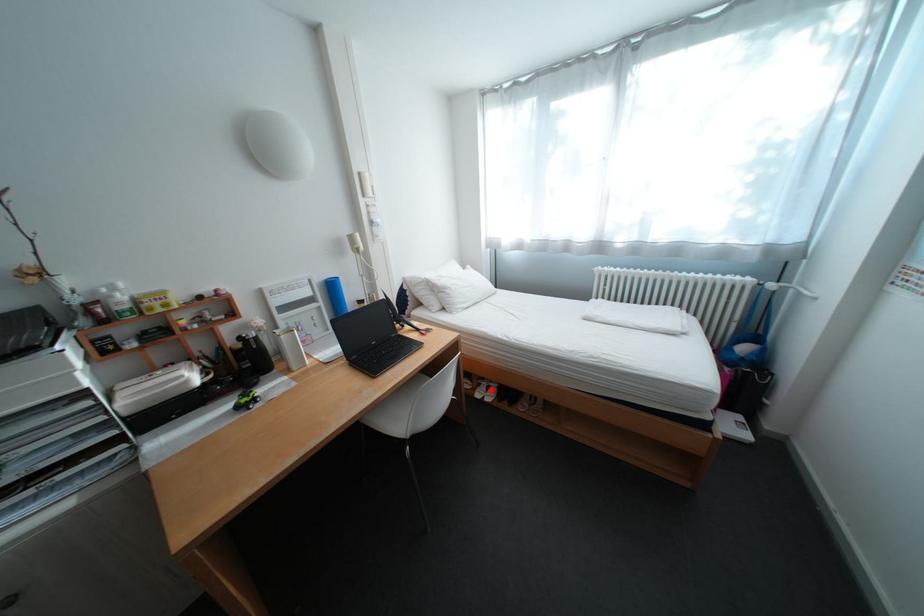
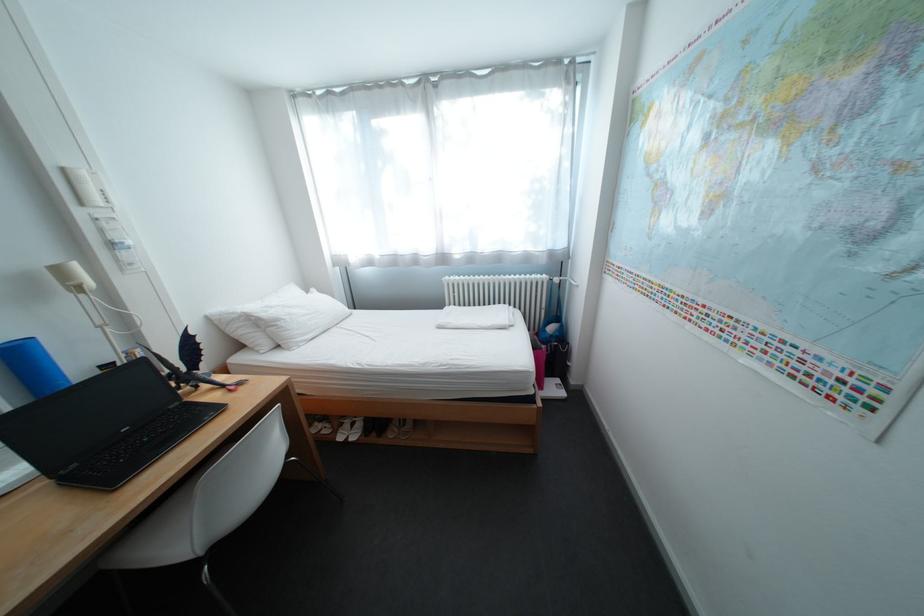
In the second image, find the point that corresponds to the highlighted location in the first image.

(353, 431)